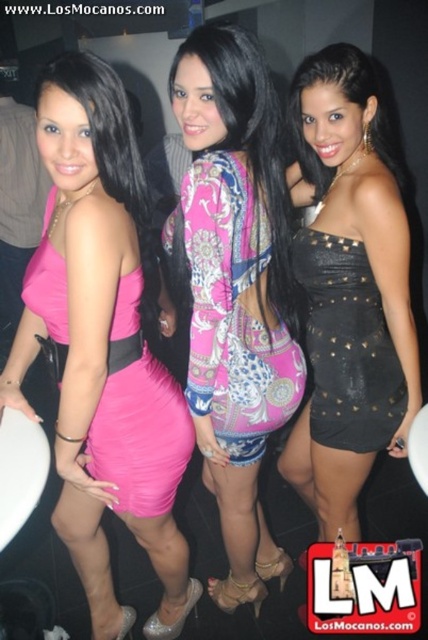
Question: Which of the following is the closest to the observer?

Choices:
 (A) matte pink dress at left
 (B) pink printed dress at center
 (C) pink satin dress at left

Answer: (C)

Question: Which is farther from the pink satin dress at left?

Choices:
 (A) black studded dress at center
 (B) matte pink dress at left
 (C) black studded dress at right
 (D) pink printed dress at center

Answer: (C)

Question: Which point appears farthest from the camera in this image?

Choices:
 (A) (350, 202)
 (B) (382, 349)

Answer: (B)

Question: Is black studded dress at center bigger than black studded dress at right?

Choices:
 (A) no
 (B) yes

Answer: (B)

Question: Can you confirm if pink printed dress at center is positioned below black studded dress at center?

Choices:
 (A) yes
 (B) no

Answer: (A)

Question: Where is pink satin dress at left located in relation to pink printed dress at center in the image?

Choices:
 (A) right
 (B) left

Answer: (B)